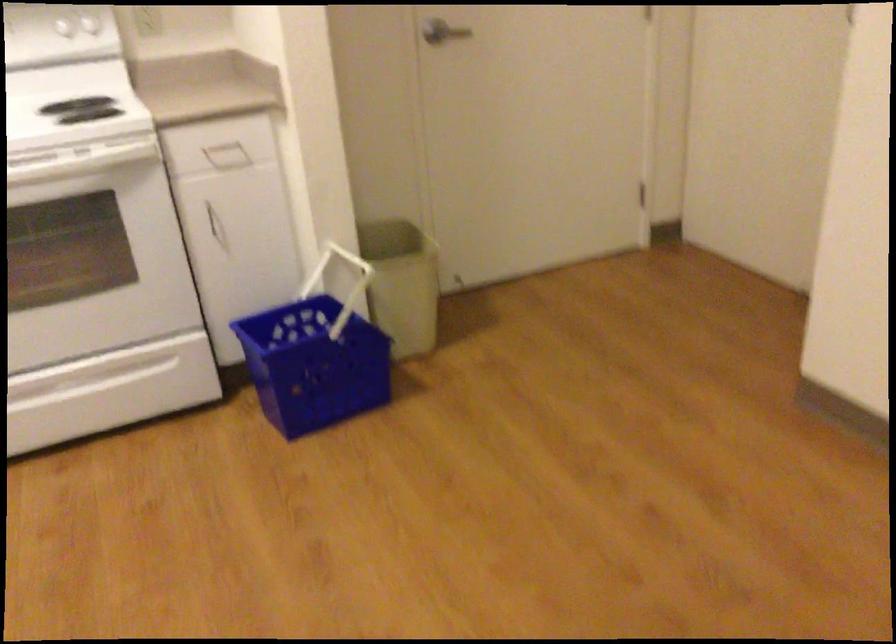
Find where to pull the oven door handle. Please return your answer as a coordinate pair (x, y).

(216, 225)